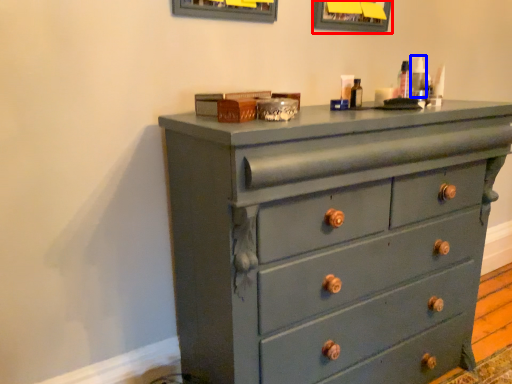
Question: Among these objects, which one is nearest to the camera, picture frame (highlighted by a red box) or toiletry (highlighted by a blue box)?

Choices:
 (A) picture frame
 (B) toiletry

Answer: (B)